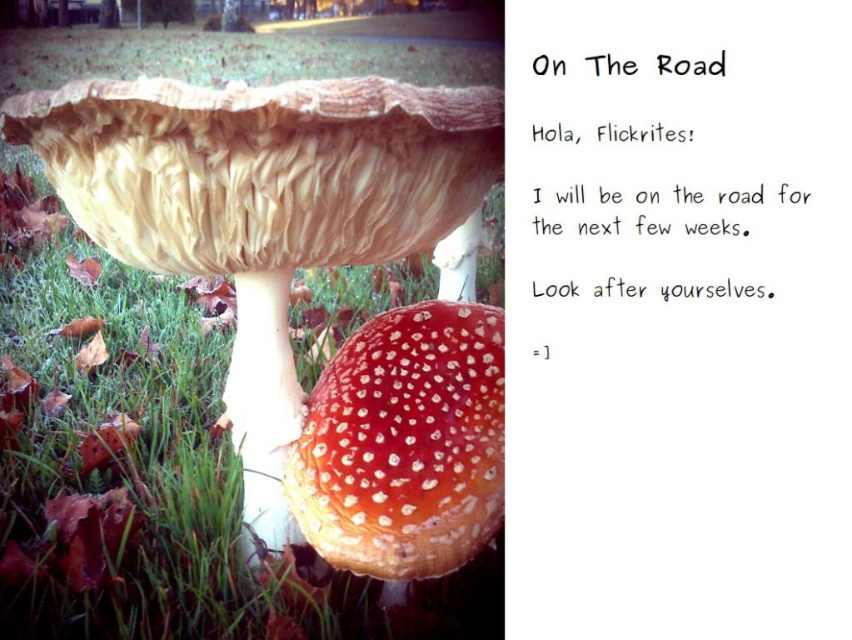
Who is positioned more to the left, green grass at lower left or red matte mushroom at center?

Positioned to the left is green grass at lower left.

Between green grass at lower left and red matte mushroom at center, which one has more height?

Standing taller between the two is green grass at lower left.

Where is `green grass at lower left`? The width and height of the screenshot is (852, 640). green grass at lower left is located at coordinates (131, 458).